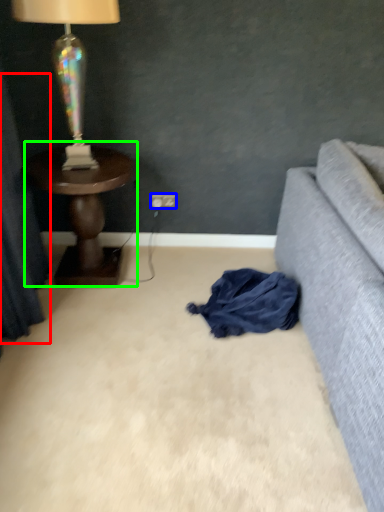
Question: Estimate the real-world distances between objects in this image. Which object is closer to curtain (highlighted by a red box), power outlet (highlighted by a blue box) or table (highlighted by a green box)?

Choices:
 (A) power outlet
 (B) table

Answer: (B)